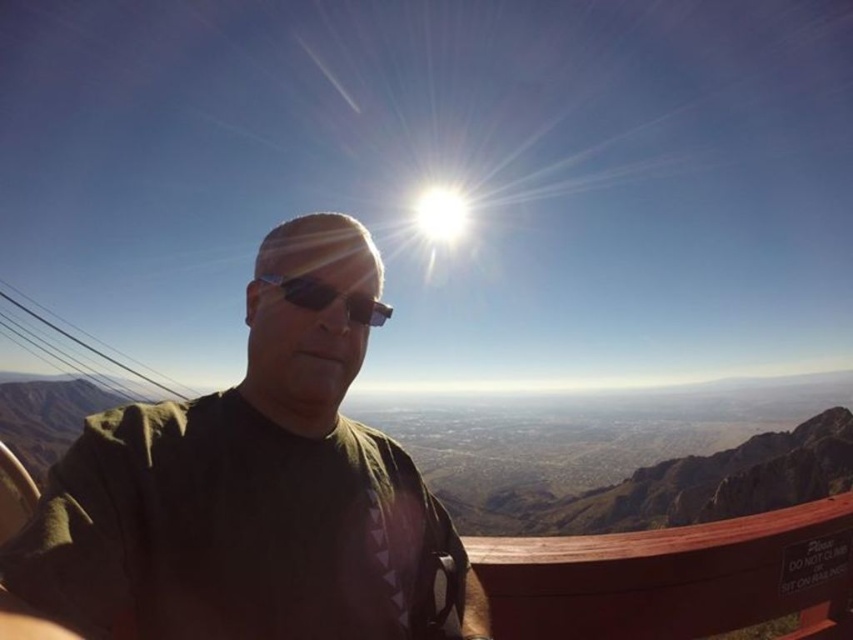
Question: Which object is farther from the camera taking this photo?

Choices:
 (A) dark green t-shirt at center
 (B) sunglasses at center

Answer: (B)

Question: Does dark green t-shirt at center appear under sunglasses at center?

Choices:
 (A) no
 (B) yes

Answer: (B)

Question: Can you confirm if dark green t-shirt at center is positioned to the right of sunglasses at center?

Choices:
 (A) yes
 (B) no

Answer: (B)

Question: Among these objects, which one is nearest to the camera?

Choices:
 (A) sunglasses at center
 (B) dark green t-shirt at center

Answer: (B)

Question: Which point is closer to the camera taking this photo?

Choices:
 (A) (368, 298)
 (B) (254, 636)

Answer: (B)

Question: Is dark green t-shirt at center wider than sunglasses at center?

Choices:
 (A) no
 (B) yes

Answer: (B)